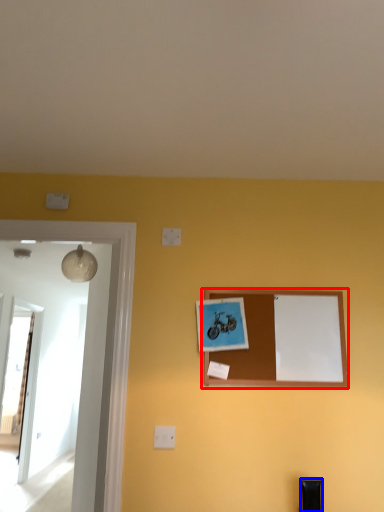
Question: Which of the following is the farthest to the observer, picture frame (highlighted by a red box) or furniture (highlighted by a blue box)?

Choices:
 (A) picture frame
 (B) furniture

Answer: (A)